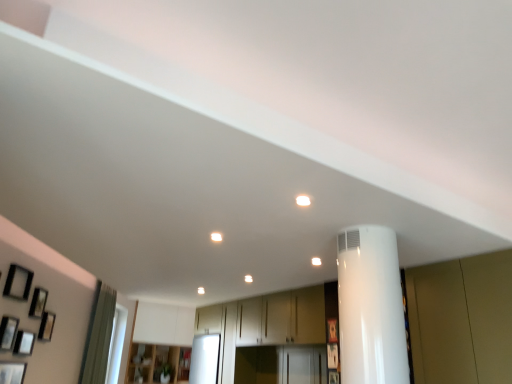
Question: Does point (2, 362) appear closer or farther from the camera than point (12, 334)?

Choices:
 (A) farther
 (B) closer

Answer: (B)

Question: Is matte black picture frame at lower left, placed as the 1th picture frame when sorted from left to right, in front of or behind matte black picture frame at left, acting as the fifth picture frame starting from the right, in the image?

Choices:
 (A) front
 (B) behind

Answer: (A)

Question: Based on their relative distances, which object is farther from the white glossy water heater at right?

Choices:
 (A) wooden picture frame at lower left, arranged as the 7th picture frame when viewed from the right
 (B) wooden picture frame at left, the 3th picture frame when ordered from left to right
 (C) matte black picture frame at lower left, placed as the 1th picture frame when sorted from left to right
 (D) wooden cabinet at center
 (E) matte black picture frame at left, acting as the fifth picture frame starting from the right

Answer: (D)

Question: Which is nearer to the wooden picture frame at center, which is the eighth picture frame from left to right?

Choices:
 (A) wooden picture frame at lower right, which appears as the second picture frame when viewed from the right
 (B) white glossy water heater at right
 (C) matte black picture frame at left, acting as the fifth picture frame starting from the right
 (D) matte black picture frame at left, the 6th picture frame viewed from the left
 (E) matte black picture frame at lower left, placed as the 1th picture frame when sorted from left to right

Answer: (A)